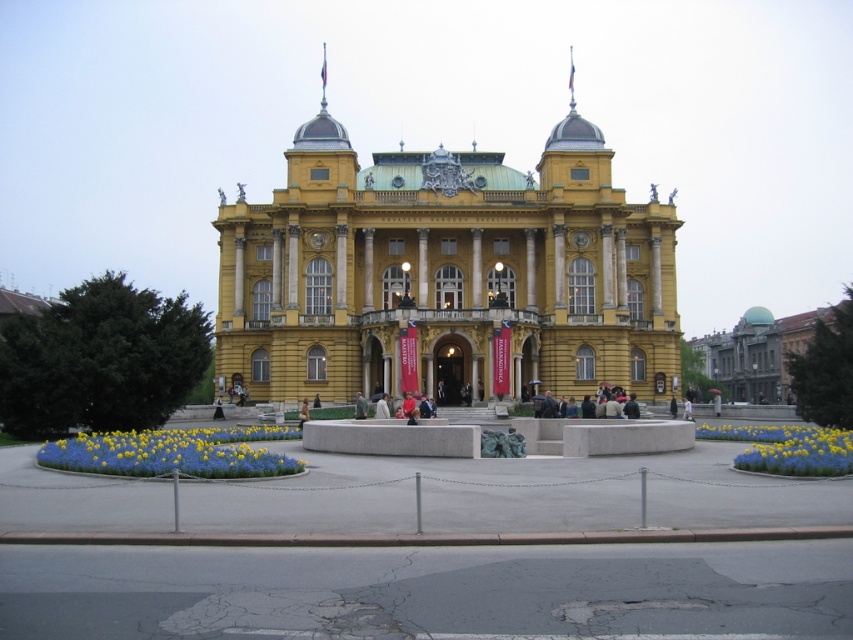
Question: Can you confirm if dark gray stone building at center is thinner than dark gray fabric jacket at center?

Choices:
 (A) yes
 (B) no

Answer: (B)

Question: Which point is closer to the camera?

Choices:
 (A) black fabric person at center
 (B) yellow stone building at center
 (C) khaki fabric jacket at center

Answer: (B)

Question: Can you confirm if blue matte flowers at lower left is thinner than dark gray fabric jacket at center?

Choices:
 (A) no
 (B) yes

Answer: (A)

Question: Is blue matte flowers at lower left smaller than dark gray fabric jacket at center?

Choices:
 (A) no
 (B) yes

Answer: (A)

Question: Which point is farther from the camera taking this photo?

Choices:
 (A) (363, 406)
 (B) (764, 372)
 (C) (312, 401)
 (D) (300, 426)

Answer: (B)

Question: Estimate the real-world distances between objects in this image. Which object is farther from the black fabric person at center?

Choices:
 (A) dark gray fabric jacket at center
 (B) dark gray stone building at center
 (C) blue matte flowers at lower left

Answer: (B)